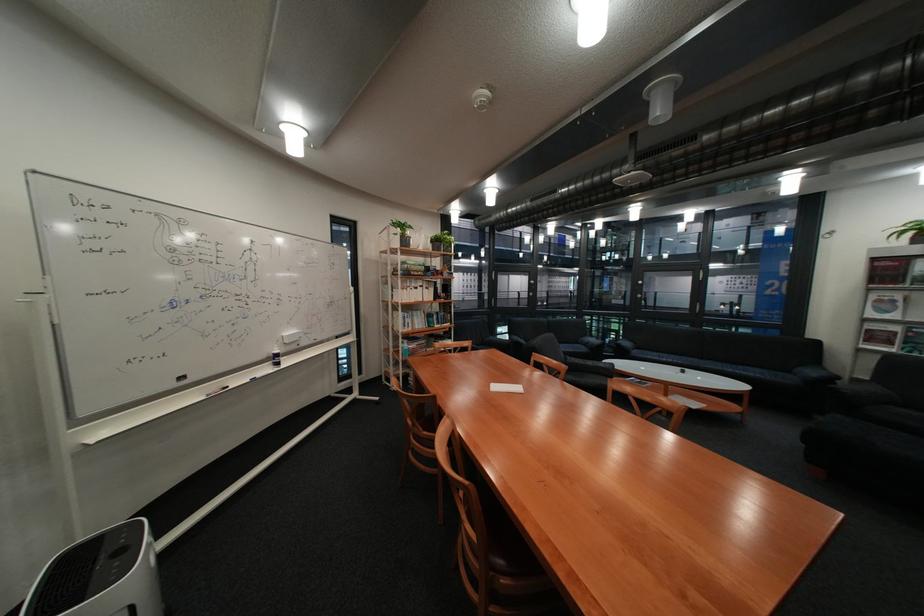
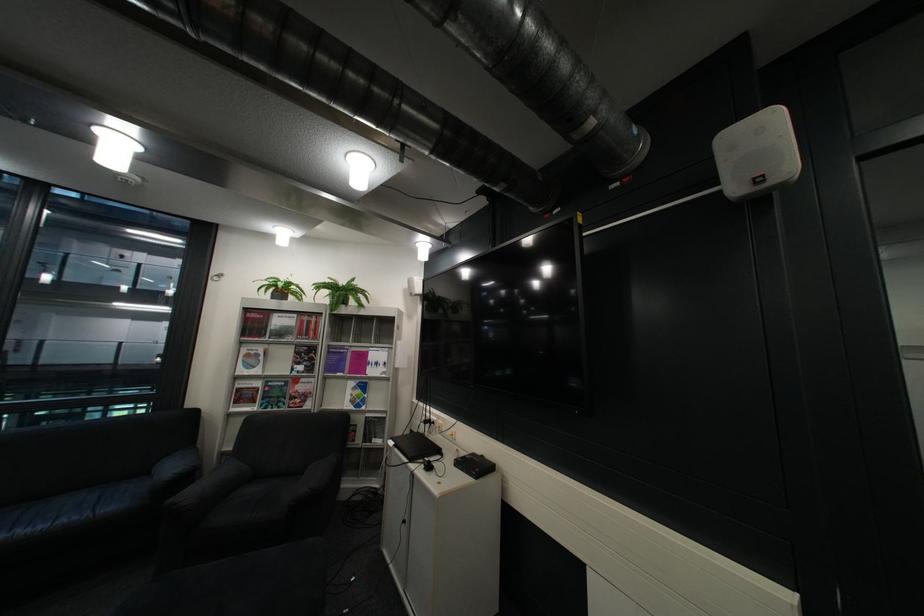
Where in the second image is the point corresponding to (x=885, y=331) from the first image?

(254, 390)